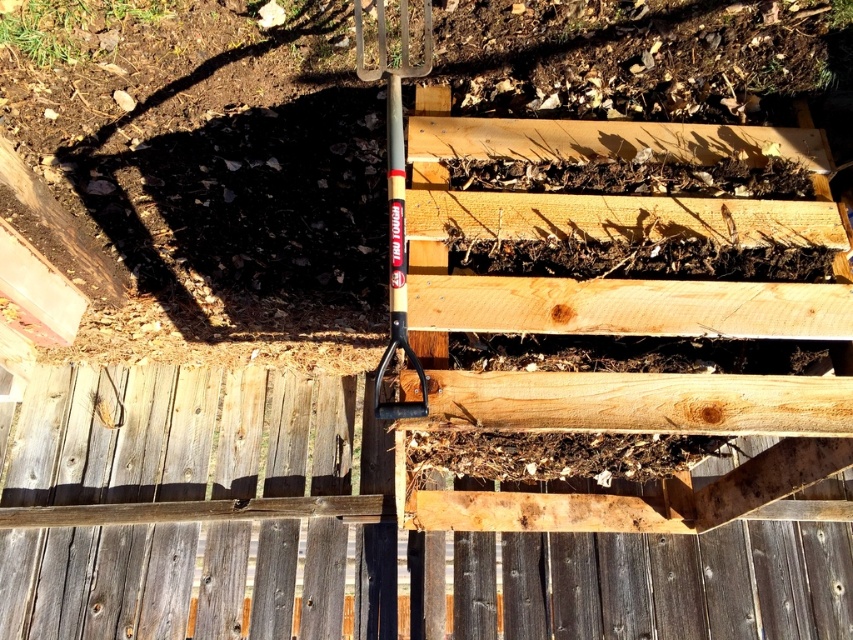
Between point (108, 573) and point (357, 38), which one is positioned in front?

Positioned in front is point (357, 38).

Can you confirm if weathered wood fence at center is positioned to the left of wooden handle shovel at center?

Incorrect, weathered wood fence at center is not on the left side of wooden handle shovel at center.

Which is behind, point (51, 422) or point (405, 333)?

Point (51, 422)

Where is `weathered wood fence at center`? weathered wood fence at center is located at coordinates (190, 436).